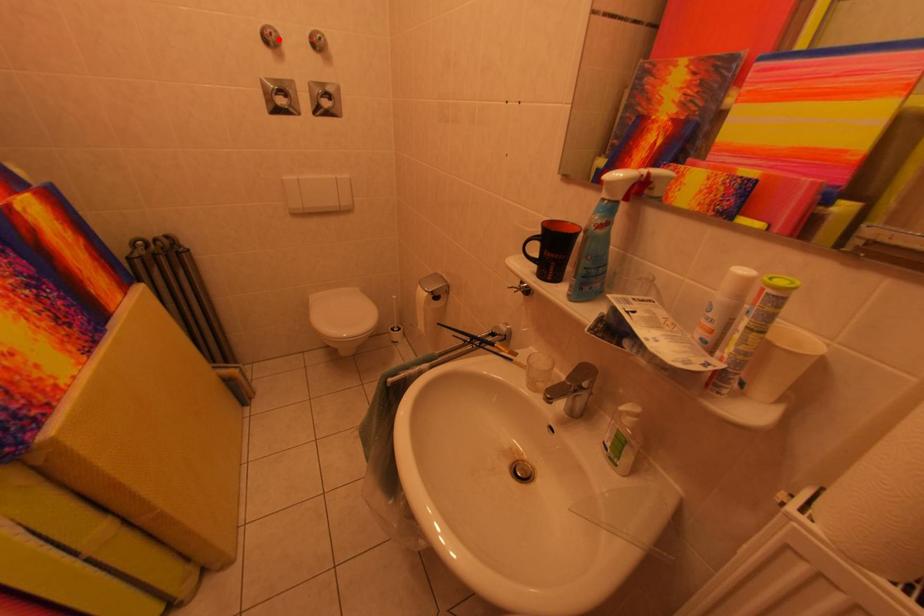
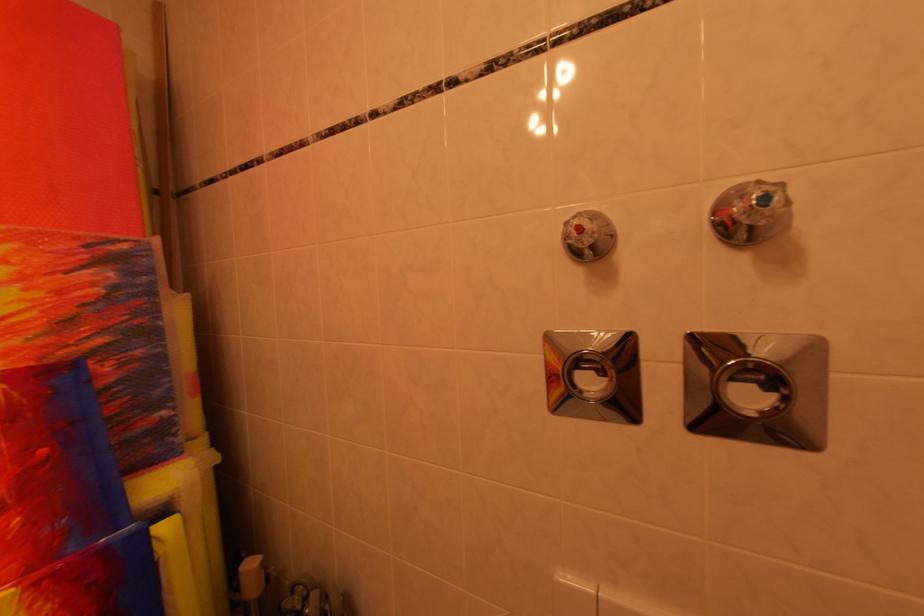
The point at the highlighted location is marked in the first image. Where is the corresponding point in the second image?

(589, 232)